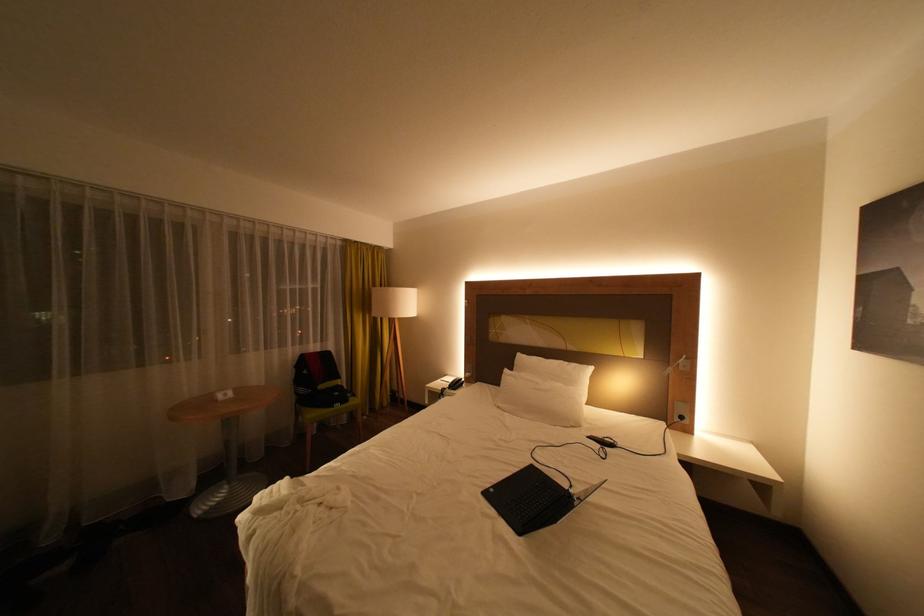
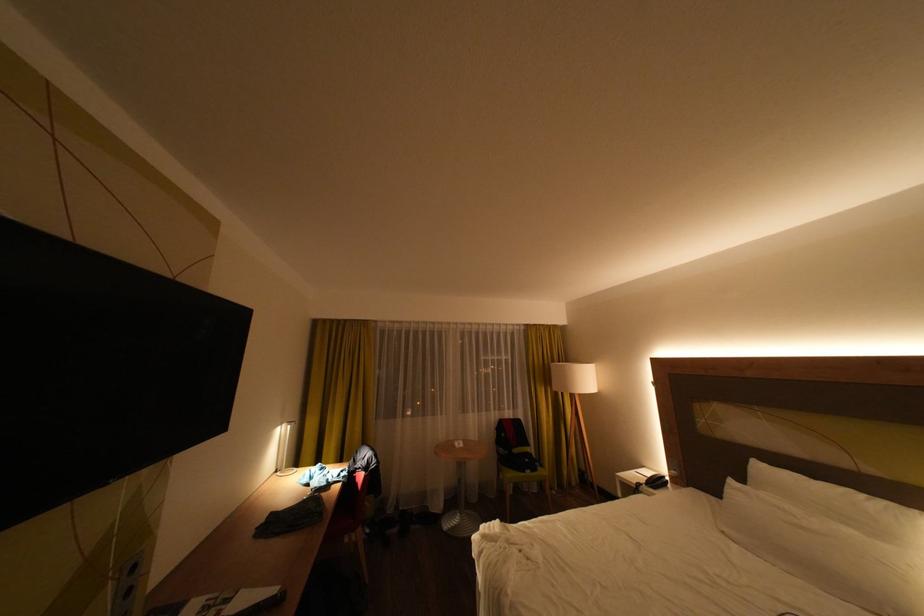
Find the pixel in the second image that matches [347,394] in the first image.

(538, 460)